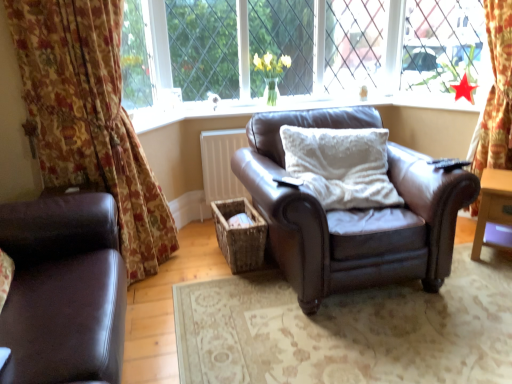
Question: Is floral fabric curtain at left in front of or behind matte brown leather armchair at center in the image?

Choices:
 (A) behind
 (B) front

Answer: (B)

Question: Considering the positions of floral fabric curtain at left and matte brown leather armchair at center in the image, is floral fabric curtain at left wider or thinner than matte brown leather armchair at center?

Choices:
 (A) thin
 (B) wide

Answer: (B)

Question: Considering the real-world distances, which object is farthest from the metallic mesh at upper right?

Choices:
 (A) matte brown leather armchair at left
 (B) yellow glass vase at upper center
 (C) matte brown leather armchair at center
 (D) wooden side table at right
 (E) woven brown basket at center

Answer: (A)

Question: Considering the real-world distances, which object is farthest from the yellow glass vase at upper center?

Choices:
 (A) matte brown leather armchair at center
 (B) matte brown leather armchair at left
 (C) white fluffy pillow at center
 (D) floral fabric curtain at left
 (E) wooden side table at right

Answer: (B)